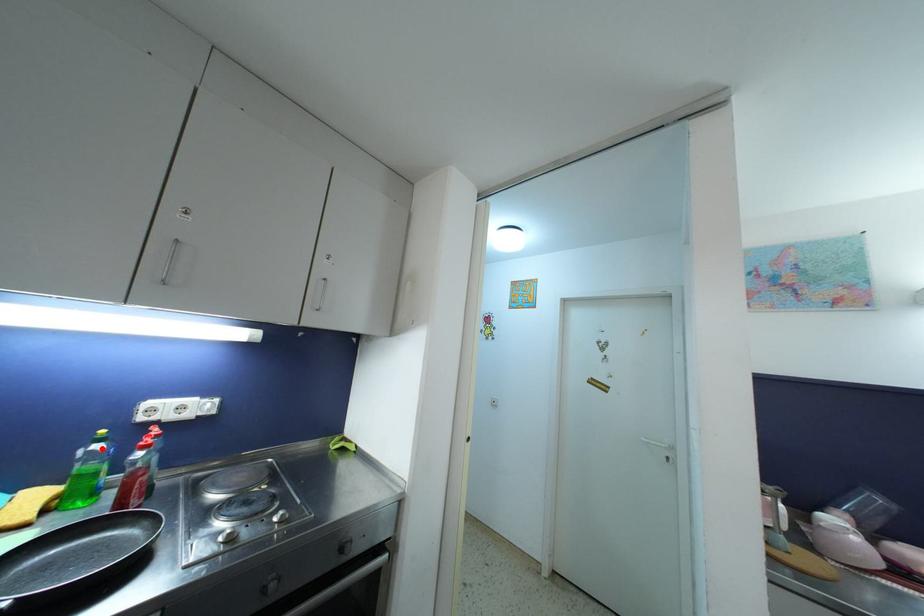
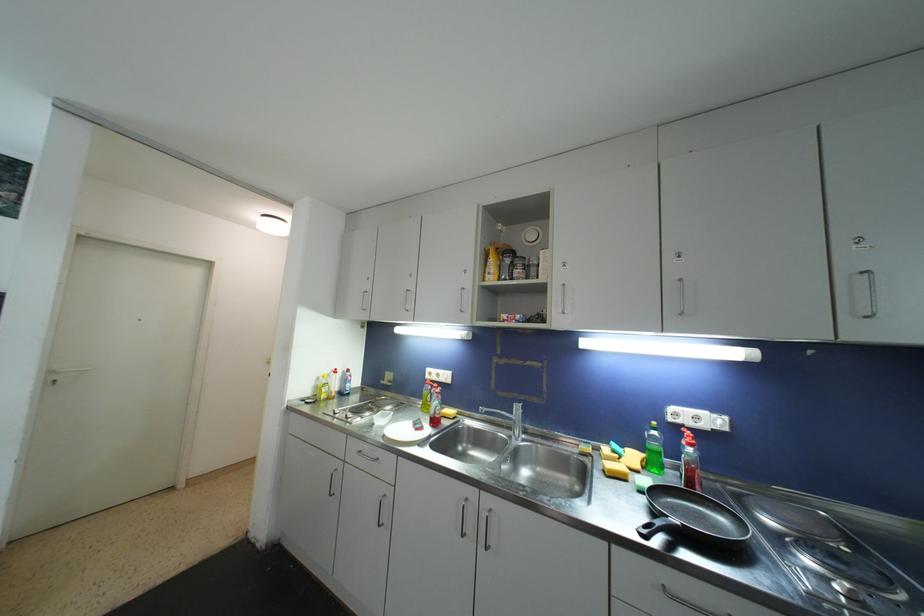
Locate, in the second image, the point that corresponds to the highlighted location in the first image.

(658, 436)